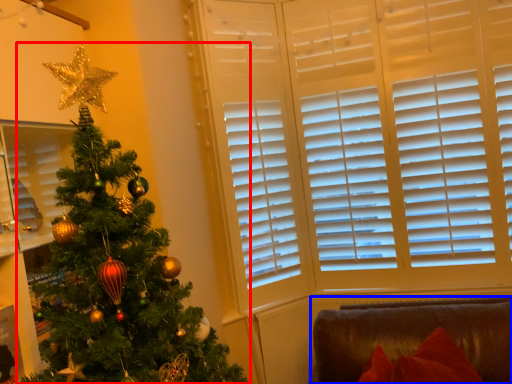
Question: Which object appears closest to the camera in this image, christmas tree (highlighted by a red box) or furniture (highlighted by a blue box)?

Choices:
 (A) christmas tree
 (B) furniture

Answer: (A)